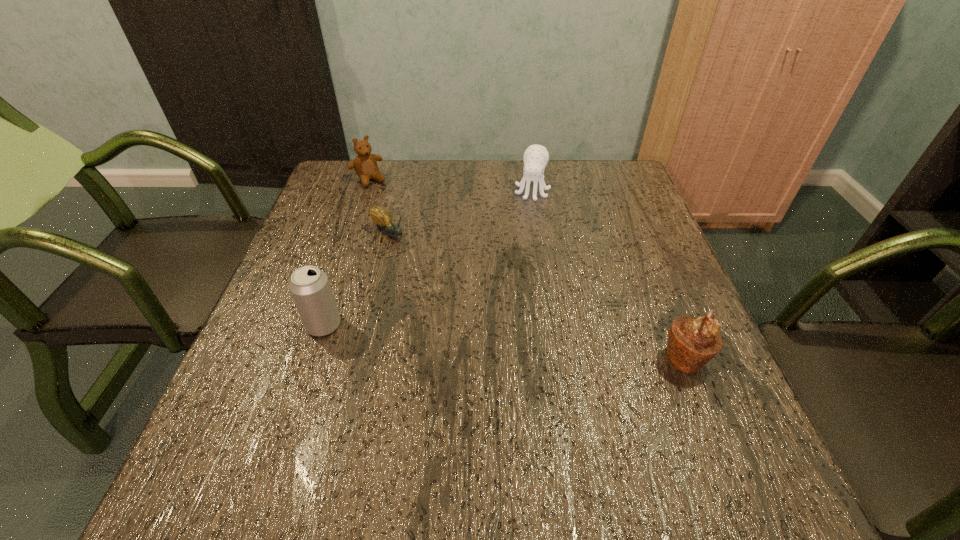
Identify the location of beer can present at the left edge. This screenshot has height=540, width=960. (309, 286).

Where is `teddy bear located at the left edge`? The height and width of the screenshot is (540, 960). teddy bear located at the left edge is located at coordinates (365, 165).

I want to click on object that is at the right edge, so click(x=692, y=342).

Where is `object at the far left corner`? This screenshot has width=960, height=540. object at the far left corner is located at coordinates (365, 165).

Locate an element on the screen. The height and width of the screenshot is (540, 960). vacant space at the far edge of the desktop is located at coordinates (533, 190).

The image size is (960, 540). Identify the location of vacant position at the near edge of the desktop. (355, 403).

The image size is (960, 540). Find the location of `vacant space at the left edge of the desktop`. vacant space at the left edge of the desktop is located at coordinates (308, 216).

Locate an element on the screen. vacant area at the right edge is located at coordinates (633, 253).

The height and width of the screenshot is (540, 960). Identify the location of free region at the far left corner. (337, 181).

At what (x,y) coordinates should I click in order to perform the action: click on vacant space at the far right corner. Please return your answer as a coordinate pair (x, y). This screenshot has height=540, width=960. Looking at the image, I should click on (622, 181).